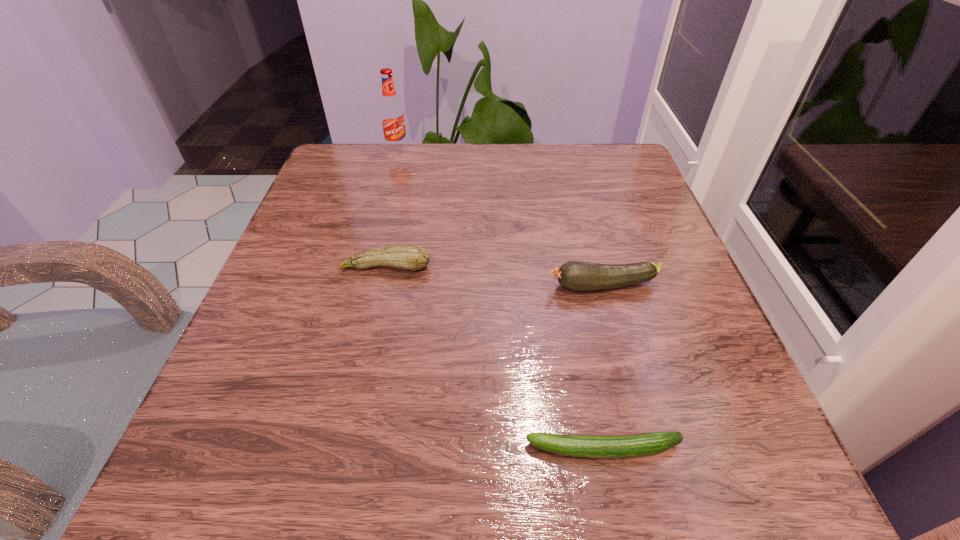
In the image, there is a desktop. Where is `vacant space at the near left corner`? The height and width of the screenshot is (540, 960). vacant space at the near left corner is located at coordinates (289, 502).

Where is `free space at the far right corner of the desktop`? This screenshot has height=540, width=960. free space at the far right corner of the desktop is located at coordinates (576, 147).

This screenshot has height=540, width=960. What are the coordinates of `vacant space that's between the farthest object and the shortest zucchini` in the screenshot? It's located at 500,300.

In order to click on vacant space that is in between the root beer and the leftmost zucchini in this screenshot , I will do (x=392, y=208).

Where is `free space that is in between the leftmost zucchini and the farthest object`? This screenshot has height=540, width=960. free space that is in between the leftmost zucchini and the farthest object is located at coordinates (392, 208).

At what (x,y) coordinates should I click in order to perform the action: click on vacant area that lies between the tallest object and the shortest zucchini. Please return your answer as a coordinate pair (x, y). This screenshot has height=540, width=960. Looking at the image, I should click on (500, 300).

You are a GUI agent. You are given a task and a screenshot of the screen. Output one action in this format:
    pyautogui.click(x=<x>, y=<y>)
    Task: Click on the unoccupied area between the shortest zucchini and the leftmost zucchini
    
    Given the screenshot: What is the action you would take?
    pyautogui.click(x=494, y=358)

Find the location of `object that is the closest to the leftmost zucchini`. object that is the closest to the leftmost zucchini is located at coordinates (574, 275).

Where is `object that is the closest to the shortest object`? Image resolution: width=960 pixels, height=540 pixels. object that is the closest to the shortest object is located at coordinates (574, 275).

Where is `zucchini object that ranks as the third closest to the tallest object`? The width and height of the screenshot is (960, 540). zucchini object that ranks as the third closest to the tallest object is located at coordinates (638, 445).